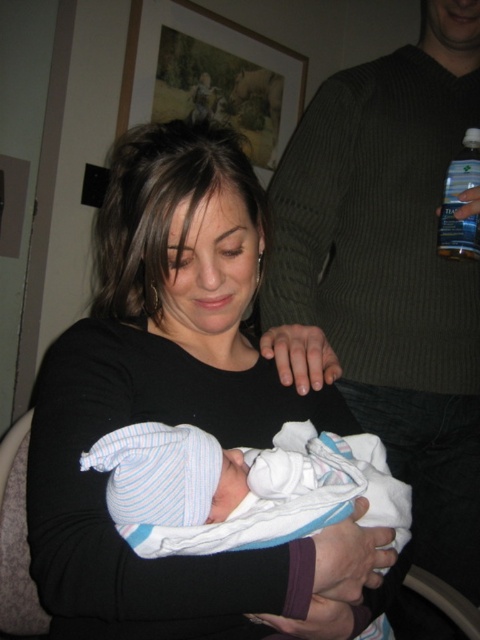
Question: Does striped knit hat at center have a smaller size compared to clear plastic bottle at upper right?

Choices:
 (A) yes
 (B) no

Answer: (B)

Question: In this image, where is black matte shirt at center located relative to clear plastic bottle at upper right?

Choices:
 (A) above
 (B) below

Answer: (B)

Question: Does black matte shirt at center appear over striped knit hat at center?

Choices:
 (A) no
 (B) yes

Answer: (B)

Question: Estimate the real-world distances between objects in this image. Which object is closer to the black matte shirt at center?

Choices:
 (A) clear plastic bottle at upper right
 (B) striped knit hat at center
 (C) ribbed sweater at upper right

Answer: (B)

Question: Among these objects, which one is nearest to the camera?

Choices:
 (A) black matte shirt at center
 (B) striped knit hat at center
 (C) ribbed sweater at upper right
 (D) clear plastic bottle at upper right

Answer: (B)

Question: Which point is farther to the camera?

Choices:
 (A) (322, 502)
 (B) (457, 324)
 (C) (199, 372)
 (D) (460, 230)

Answer: (B)